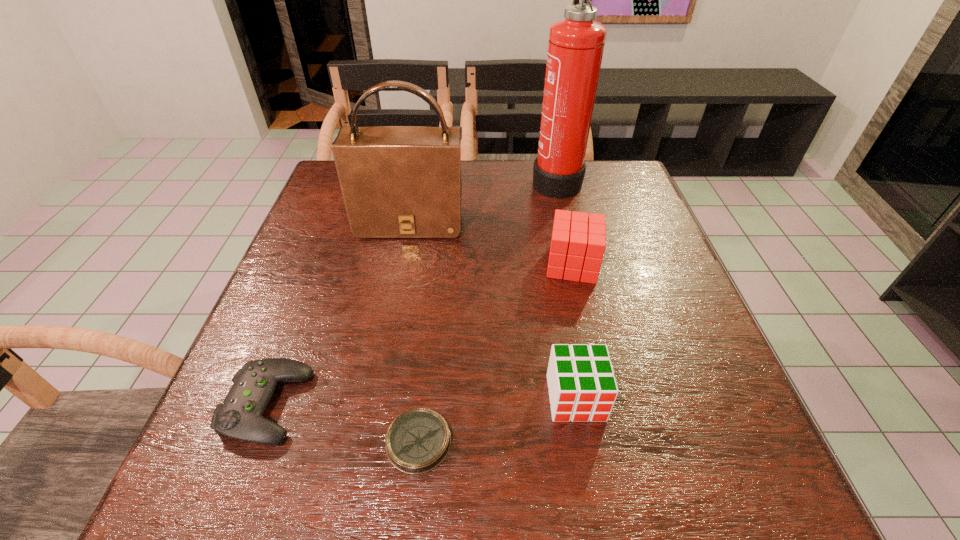
I want to click on free space located 0.200m on the front-facing side of the fire extinguisher, so click(x=463, y=180).

Locate an element on the screen. Image resolution: width=960 pixels, height=540 pixels. blank space located on the front-facing side of the fire extinguisher is located at coordinates (428, 180).

Identify the location of vacant area located on the front-facing side of the fire extinguisher. This screenshot has width=960, height=540. (472, 180).

Where is `free location located on the front flap of the fifth nearest object`? free location located on the front flap of the fifth nearest object is located at coordinates (402, 266).

Find the location of a particular element. The image size is (960, 540). blank space located on the back of the fourth shortest object is located at coordinates click(x=556, y=190).

Find the location of `free space located on the red face of the fourth tallest object`. free space located on the red face of the fourth tallest object is located at coordinates (594, 504).

The width and height of the screenshot is (960, 540). In order to click on vacant space located on the right of the control in this screenshot , I will do `click(339, 406)`.

Locate an element on the screen. The height and width of the screenshot is (540, 960). vacant space located on the left of the compass is located at coordinates pyautogui.click(x=281, y=442).

Locate an element on the screen. object that is at the far edge is located at coordinates [575, 49].

Find the location of a particular element. The image size is (960, 540). object present at the near edge is located at coordinates (418, 440).